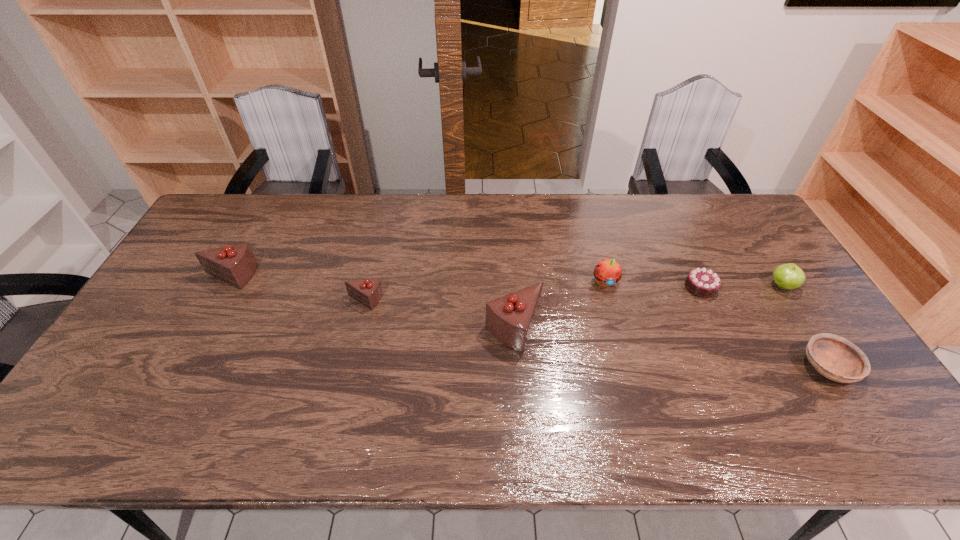
Identify the location of the closest chocolate cake to the leftmost chocolate cake. (368, 292).

Locate an element on the screen. Image resolution: width=960 pixels, height=540 pixels. free spot that satisfies the following two spatial constraints: 1. on the front side of the sixth shortest object; 2. on the left side of the rightmost chocolate cake is located at coordinates (223, 287).

I want to click on free space that satisfies the following two spatial constraints: 1. on the back side of the rightmost chocolate cake; 2. on the right side of the third chocolate cake from right to left, so click(x=368, y=287).

The width and height of the screenshot is (960, 540). Identify the location of blank space that satisfies the following two spatial constraints: 1. on the back side of the fifth object from left to right; 2. on the left side of the third chocolate cake from left to right. (512, 287).

Where is `blank area in the image that satisfies the following two spatial constraints: 1. on the back side of the rightmost chocolate cake; 2. on the left side of the right apple`? This screenshot has width=960, height=540. blank area in the image that satisfies the following two spatial constraints: 1. on the back side of the rightmost chocolate cake; 2. on the left side of the right apple is located at coordinates (700, 286).